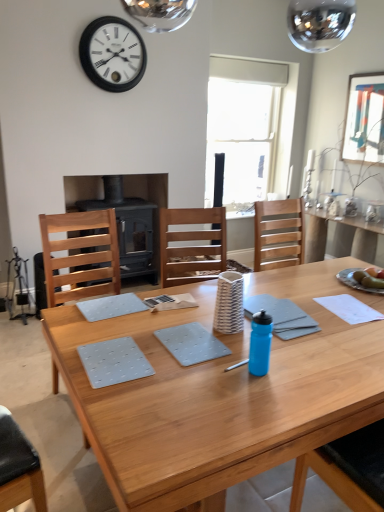
At what (x,y) coordinates should I click in order to perform the action: click on free location above wooden table at center (from a real-world perspective). Please return your answer as a coordinate pair (x, y). Looking at the image, I should click on (276, 340).